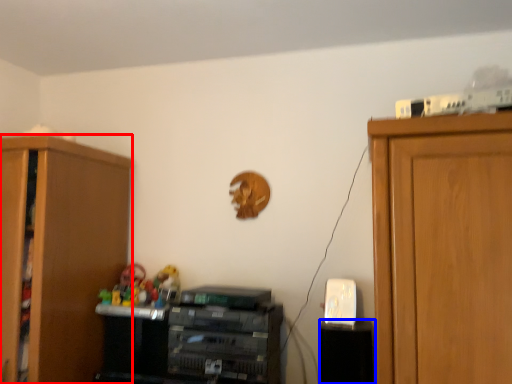
Question: Which object is further to the camera taking this photo, cabinetry (highlighted by a red box) or cabinetry (highlighted by a blue box)?

Choices:
 (A) cabinetry
 (B) cabinetry

Answer: (B)